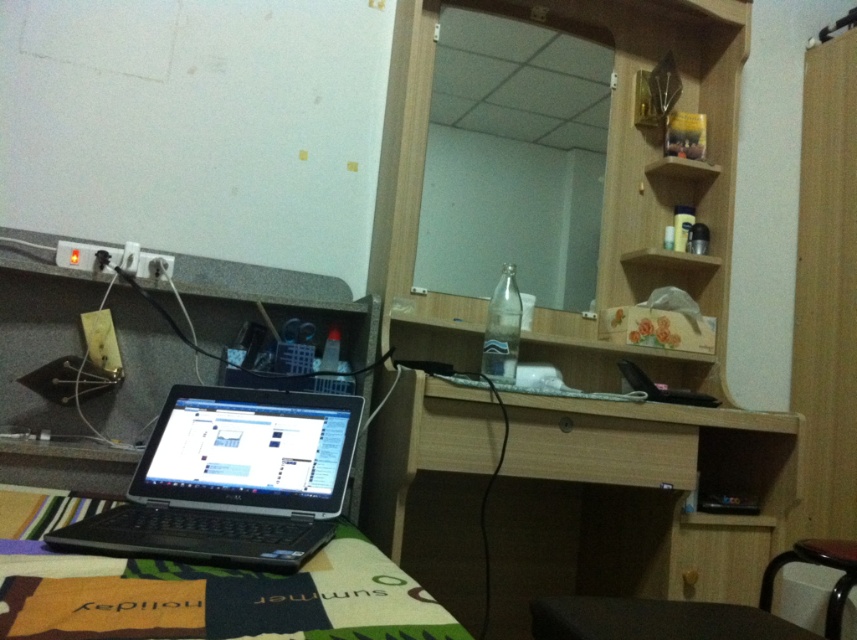
You are organizing the items on the vanity table and need to place a new decorative item. Considering the height of the black plastic laptop at lower left and the brown wooden stool at lower right, which object would be more stable to place the item on?

The brown wooden stool at lower right is taller than the black plastic laptop at lower left, so placing the decorative item on the brown wooden stool at lower right would provide a more stable and elevated position.